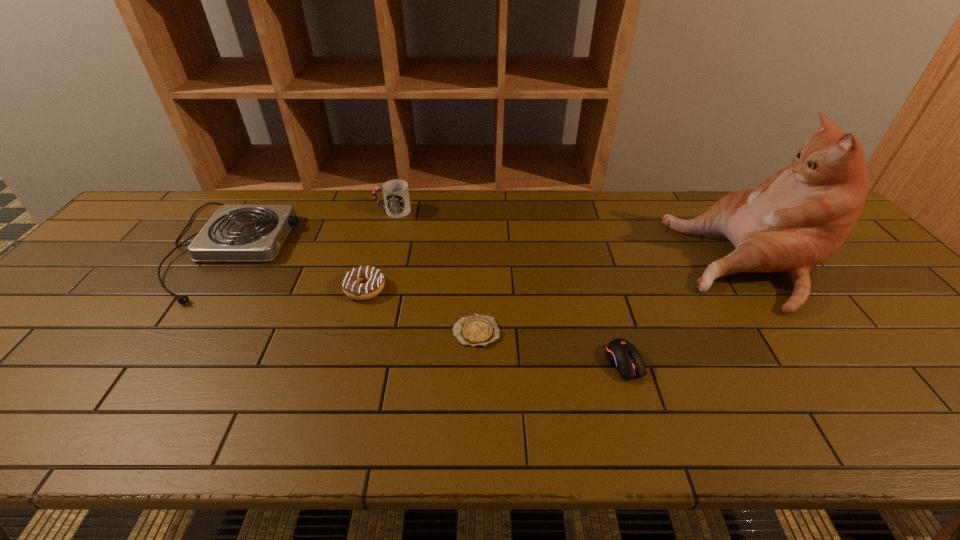
Where is `blank region between the rightmost object and the doughnut`? The width and height of the screenshot is (960, 540). blank region between the rightmost object and the doughnut is located at coordinates (560, 276).

At what (x,y) coordinates should I click in order to perform the action: click on vacant area that lies between the hotplate and the doughnut. Please return your answer as a coordinate pair (x, y). The height and width of the screenshot is (540, 960). Looking at the image, I should click on (297, 268).

This screenshot has height=540, width=960. I want to click on empty space that is in between the fourth object from left to right and the computer mouse, so click(x=550, y=347).

Locate an element on the screen. vacant space in between the tallest object and the cup is located at coordinates (574, 237).

Locate an element on the screen. The width and height of the screenshot is (960, 540). vacant area that lies between the fifth shortest object and the cat is located at coordinates (574, 237).

This screenshot has width=960, height=540. In order to click on empty space that is in between the doughnut and the cup in this screenshot , I will do `click(379, 250)`.

This screenshot has height=540, width=960. In order to click on free space between the cup and the doughnut in this screenshot , I will do `click(379, 250)`.

At what (x,y) coordinates should I click in order to perform the action: click on free point between the tallest object and the computer mouse. Please return your answer as a coordinate pair (x, y). Looking at the image, I should click on (689, 313).

The image size is (960, 540). Find the location of `free spot between the shortest object and the doughnut`. free spot between the shortest object and the doughnut is located at coordinates (420, 310).

Locate which object ranks third in proximity to the doughnut. Please provide its 2D coordinates. Your answer should be formatted as a tuple, i.e. [(x, y)], where the tuple contains the x and y coordinates of a point satisfying the conditions above.

[(396, 194)]